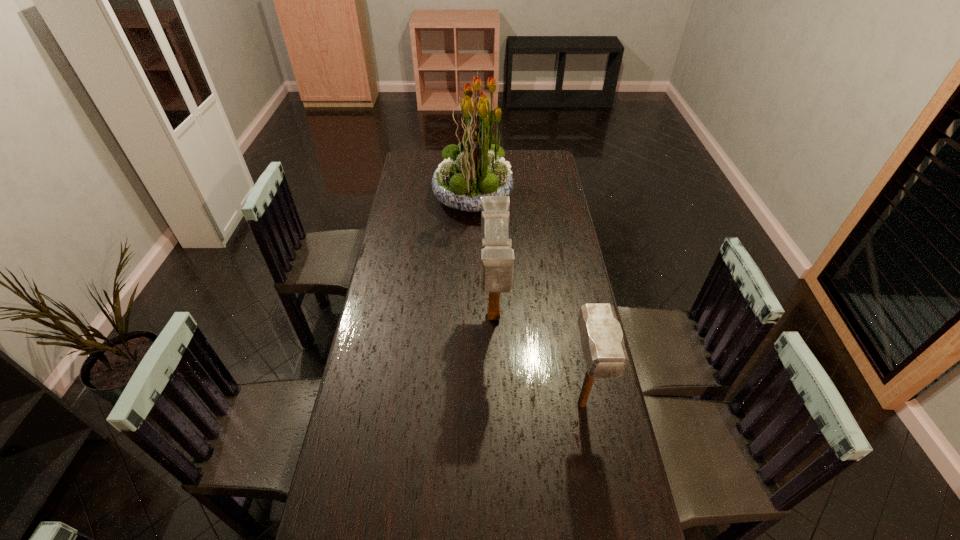
Where is `flower arrangement`? Image resolution: width=960 pixels, height=540 pixels. flower arrangement is located at coordinates (475, 167).

Locate an element on the screen. the tallest object is located at coordinates (475, 167).

You are a GUI agent. You are given a task and a screenshot of the screen. Output one action in this format:
    pyautogui.click(x=<x>, y=<y>)
    Task: Click on the left mallet
    Image resolution: width=960 pixels, height=540 pixels.
    Given the screenshot: What is the action you would take?
    pyautogui.click(x=497, y=258)

At what (x,y) coordinates should I click in order to perform the action: click on the second farthest object. Please return your answer as a coordinate pair (x, y). The image size is (960, 540). Looking at the image, I should click on (497, 258).

Locate an element on the screen. Image resolution: width=960 pixels, height=540 pixels. the right mallet is located at coordinates (602, 341).

Identify the location of the shorter mallet. (602, 341).

Identify the location of free space located on the front-facing side of the flower arrangement. (534, 195).

Locate an element on the screen. This screenshot has height=540, width=960. vacant space located on the front of the second nearest object is located at coordinates (497, 450).

At what (x,y) coordinates should I click in order to perform the action: click on free spot located 0.240m on the striking face of the nearer mallet. Please return your answer as a coordinate pair (x, y). The image size is (960, 540). Looking at the image, I should click on (604, 524).

This screenshot has width=960, height=540. What are the coordinates of `object that is at the far edge` in the screenshot? It's located at (475, 167).